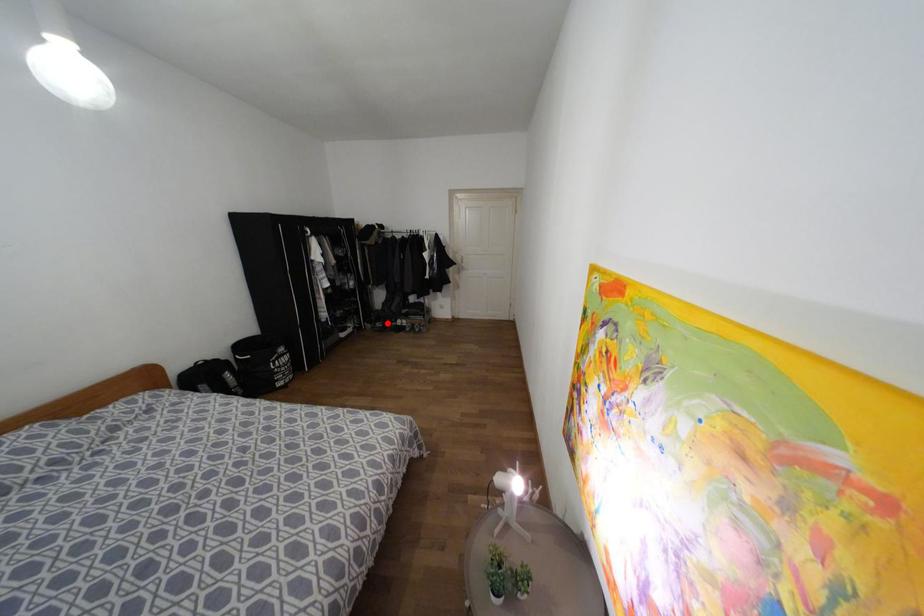
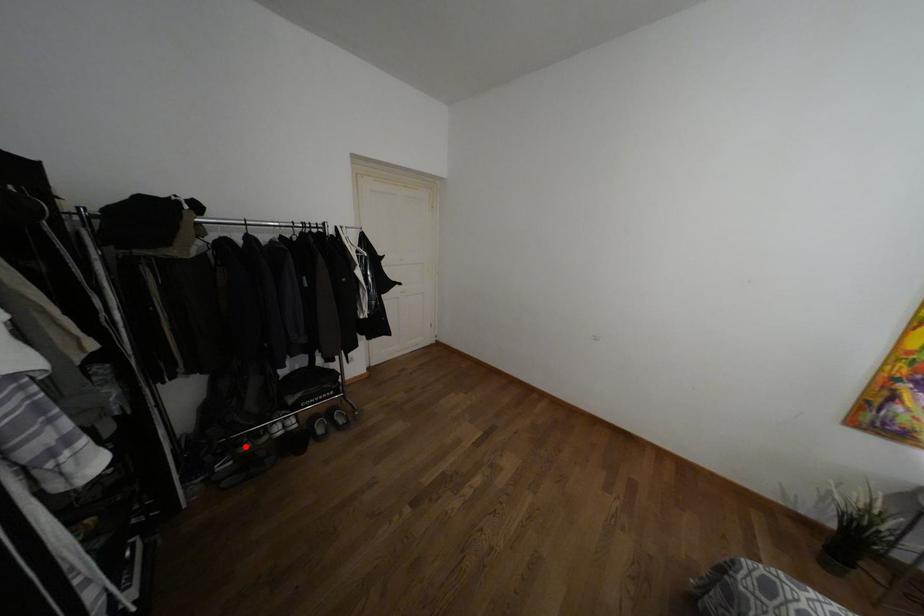
I am providing you with two images of the same scene from different viewpoints. A red point is marked on the first image and another point is marked on the second image. Are the points marked in image1 and image2 representing the same 3D position?

Yes